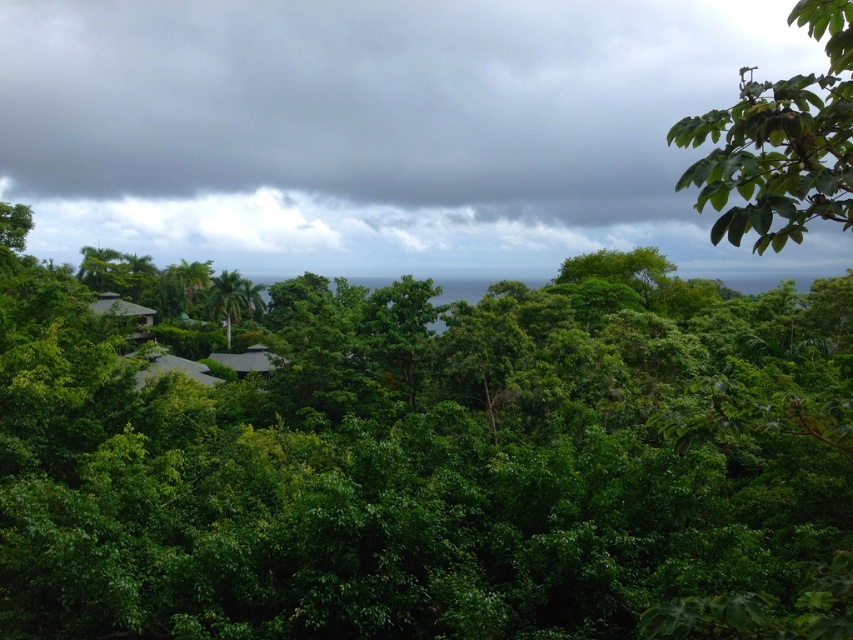
Question: Is dark gray cloud at upper center to the right of green leafy tree at upper right from the viewer's perspective?

Choices:
 (A) no
 (B) yes

Answer: (A)

Question: Which point is closer to the camera?

Choices:
 (A) (808, 170)
 (B) (146, 177)

Answer: (A)

Question: Does dark gray cloud at upper center come behind green leafy tree at upper right?

Choices:
 (A) no
 (B) yes

Answer: (B)

Question: Which of the following is the closest to the observer?

Choices:
 (A) green leafy tree at upper right
 (B) dark gray cloud at upper center

Answer: (A)

Question: Can you confirm if dark gray cloud at upper center is positioned to the left of green leafy tree at upper right?

Choices:
 (A) yes
 (B) no

Answer: (A)